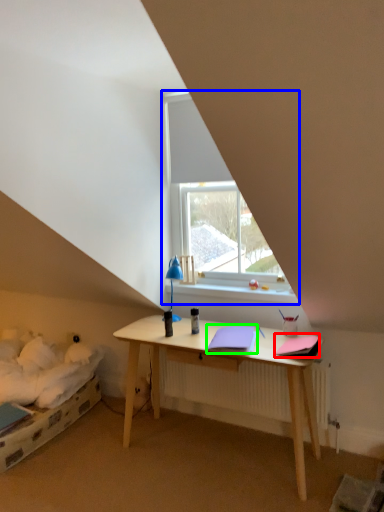
Question: Which is nearer to the notebook (highlighted by a red box)? window (highlighted by a blue box) or notebook (highlighted by a green box).

Choices:
 (A) window
 (B) notebook

Answer: (B)